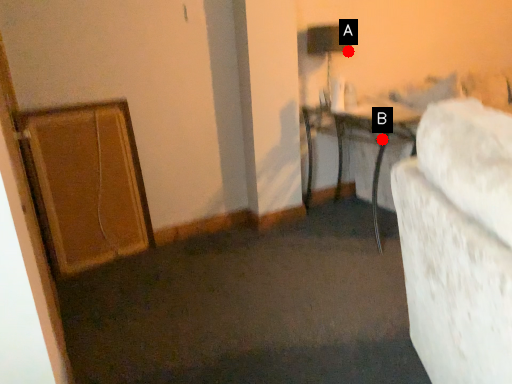
Question: Two points are circled on the image, labeled by A and B beside each circle. Which of the following is the closest to the observer?

Choices:
 (A) A is closer
 (B) B is closer

Answer: (B)